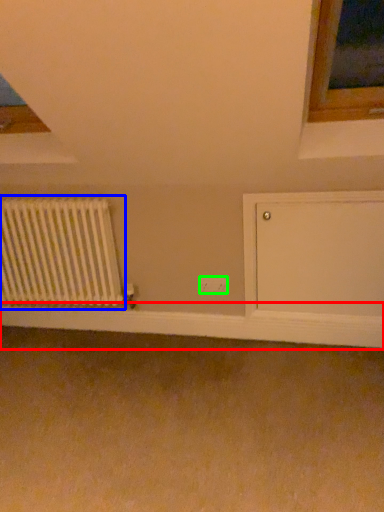
Question: Which object is positioned closest to window sill (highlighted by a red box)? Select from radiator (highlighted by a blue box) and electric outlet (highlighted by a green box).

Choices:
 (A) radiator
 (B) electric outlet

Answer: (A)